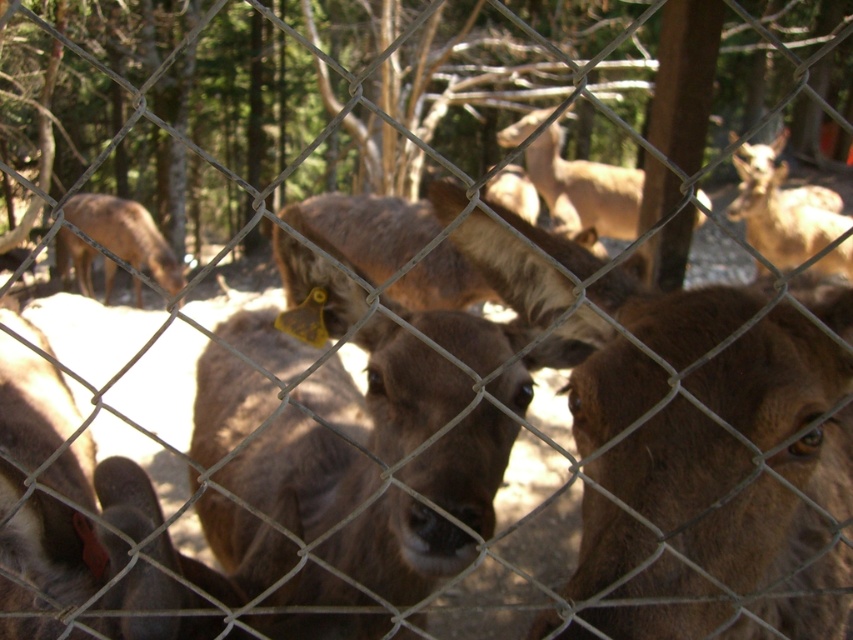
Is brown fur deer at center thinner than brown fur deer at left?

Yes.

Between point (746, 225) and point (166, 252), which one is positioned behind?

Positioned behind is point (166, 252).

Locate an element on the screen. Image resolution: width=853 pixels, height=640 pixels. brown fur deer at center is located at coordinates (x=781, y=218).

I want to click on brown furry deer at center, so click(x=703, y=456).

Can you confirm if brown furry deer at center is positioned to the right of brown fur deer at center?

In fact, brown furry deer at center is to the left of brown fur deer at center.

I want to click on brown furry deer at center, so click(703, 456).

What are the coordinates of `brown furry deer at center` in the screenshot? It's located at pyautogui.click(x=703, y=456).

The width and height of the screenshot is (853, 640). What do you see at coordinates (349, 429) in the screenshot? I see `brown matte/deer at center` at bounding box center [349, 429].

Between point (204, 374) and point (120, 204), which one is positioned behind?

Point (120, 204)

Which is in front, point (506, 356) or point (77, 268)?

Point (506, 356) is more forward.

You are a GUI agent. You are given a task and a screenshot of the screen. Output one action in this format:
    pyautogui.click(x=<x>, y=<y>)
    Task: Click on the brown matte/deer at center
    Image resolution: width=853 pixels, height=640 pixels.
    Given the screenshot: What is the action you would take?
    pyautogui.click(x=349, y=429)